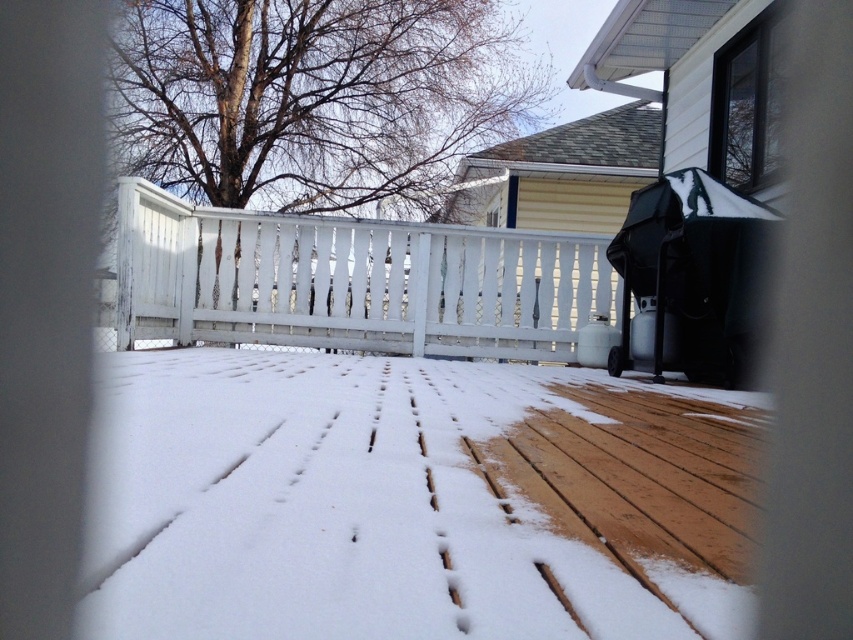
Question: Is white wood deck at center positioned in front of white painted wood porch at center?

Choices:
 (A) yes
 (B) no

Answer: (A)

Question: Which point is closer to the camera?

Choices:
 (A) white wood deck at center
 (B) white painted wood porch at center

Answer: (A)

Question: Among these objects, which one is farthest from the camera?

Choices:
 (A) white painted wood porch at center
 (B) white wood deck at center

Answer: (A)

Question: Does white wood deck at center lie behind white painted wood porch at center?

Choices:
 (A) yes
 (B) no

Answer: (B)

Question: Considering the relative positions of white wood deck at center and white painted wood porch at center in the image provided, where is white wood deck at center located with respect to white painted wood porch at center?

Choices:
 (A) above
 (B) below

Answer: (B)